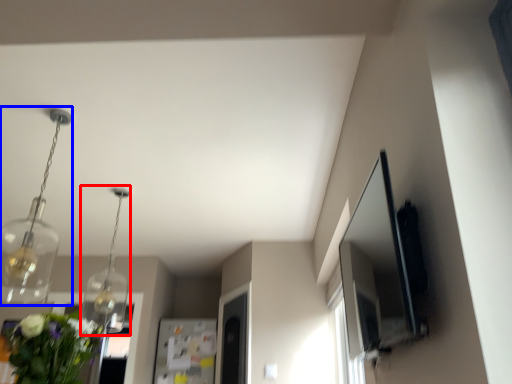
Question: Which object appears farthest to the camera in this image, light fixture (highlighted by a red box) or light fixture (highlighted by a blue box)?

Choices:
 (A) light fixture
 (B) light fixture

Answer: (A)